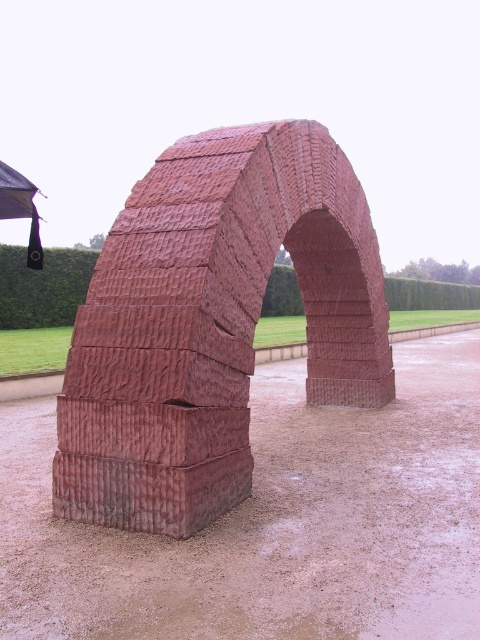
Does rustic stone arch at center have a smaller size compared to black fabric umbrella at upper left?

Yes.

Who is positioned more to the right, rustic stone arch at center or black fabric umbrella at upper left?

Positioned to the right is rustic stone arch at center.

Does point (168, 156) lie behind point (26, 212)?

No, it is not.

Where is `rustic stone arch at center`? The height and width of the screenshot is (640, 480). rustic stone arch at center is located at coordinates (212, 323).